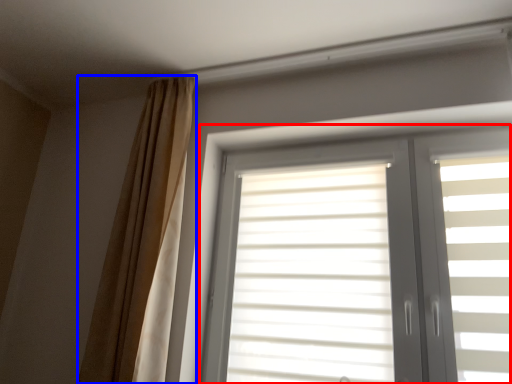
Question: Which object is closer to the camera taking this photo, window (highlighted by a red box) or curtain (highlighted by a blue box)?

Choices:
 (A) window
 (B) curtain

Answer: (A)